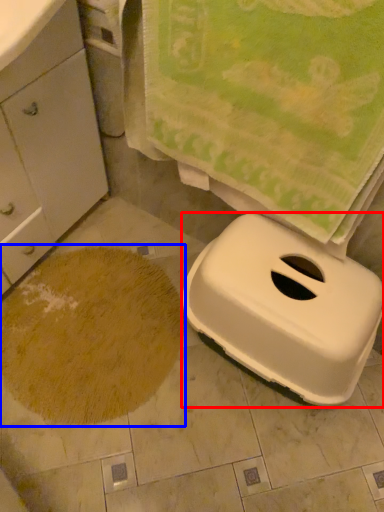
Question: Which object appears farthest to the camera in this image, appliance (highlighted by a red box) or sand (highlighted by a blue box)?

Choices:
 (A) appliance
 (B) sand

Answer: (B)